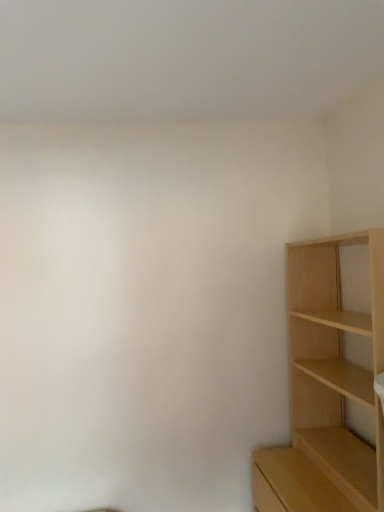
You are a GUI agent. You are given a task and a screenshot of the screen. Output one action in this format:
    pyautogui.click(x=<x>, y=<y>)
    Task: Click on the light wood shelf at right
    This screenshot has height=512, width=384.
    Given the screenshot: What is the action you would take?
    pyautogui.click(x=326, y=389)

Image resolution: width=384 pixels, height=512 pixels. Describe the element at coordinates (326, 389) in the screenshot. I see `light wood shelf at right` at that location.

Where is `light wood shelf at right`? Image resolution: width=384 pixels, height=512 pixels. light wood shelf at right is located at coordinates (326, 389).